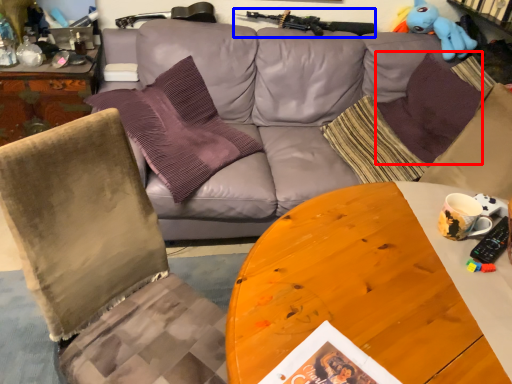
Question: Which point is further to the camera, pillow (highlighted by a red box) or gun (highlighted by a blue box)?

Choices:
 (A) pillow
 (B) gun

Answer: (B)